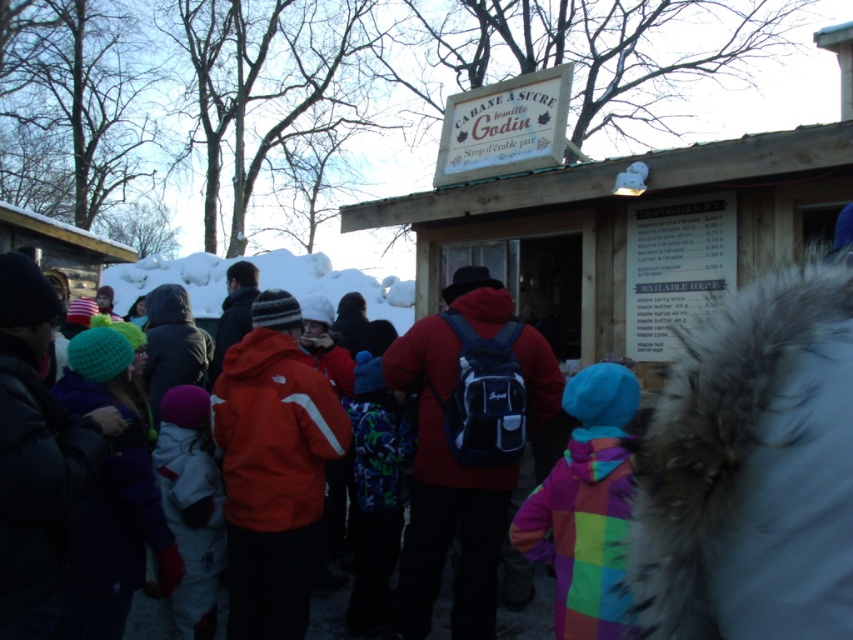
Based on the photo, does rainbow fleece jacket at lower right have a lesser width compared to white fleece jacket at center?

No, rainbow fleece jacket at lower right is not thinner than white fleece jacket at center.

From the picture: Who is more distant from viewer, (x=576, y=376) or (x=215, y=586)?

Result: Point (x=215, y=586)

This screenshot has width=853, height=640. Identify the location of rainbow fleece jacket at lower right. (585, 506).

What do you see at coordinates (375, 490) in the screenshot? I see `printed fabric backpack at center` at bounding box center [375, 490].

Does printed fabric backpack at center appear on the right side of white fluffy snow at center?

Correct, you'll find printed fabric backpack at center to the right of white fluffy snow at center.

Who is more forward, (386, 474) or (318, 284)?

Point (386, 474)

Locate an element on the screen. This screenshot has width=853, height=640. printed fabric backpack at center is located at coordinates (375, 490).

Find the location of a particular element. This screenshot has width=853, height=640. rainbow fleece jacket at lower right is located at coordinates (585, 506).

This screenshot has height=640, width=853. What are the coordinates of `rainbow fleece jacket at lower right` in the screenshot? It's located at (585, 506).